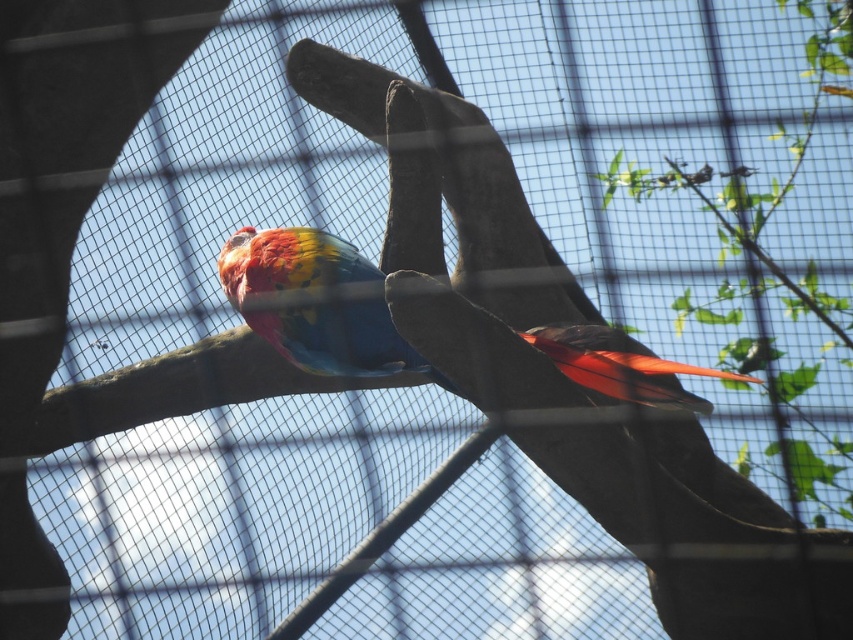
You are a zookeeper observing the parrot in its enclosure. You notice a shiny red feather at the right side of the parrot. Can you confirm if the point representing this feather is located at coordinates [624,368]?

Yes, the shiny red feathers at right is represented by point [624,368].

You are a zookeeper observing the enclosure. You notice two birds in the image. Which one is closer to you, the shiny multicolored parrot at center or the shiny metallic bird at upper center?

The shiny multicolored parrot at center is closer to the viewer than the shiny metallic bird at upper center.